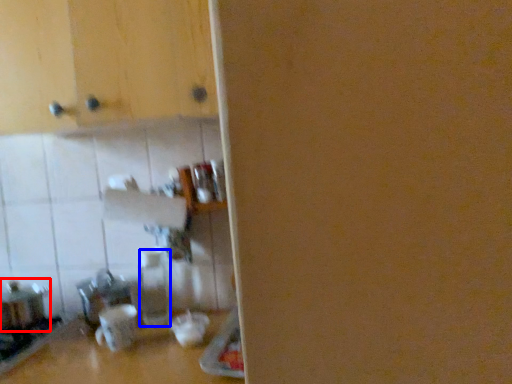
Question: Which point is further to the camera, appliance (highlighted by a red box) or bottle (highlighted by a blue box)?

Choices:
 (A) appliance
 (B) bottle

Answer: (B)